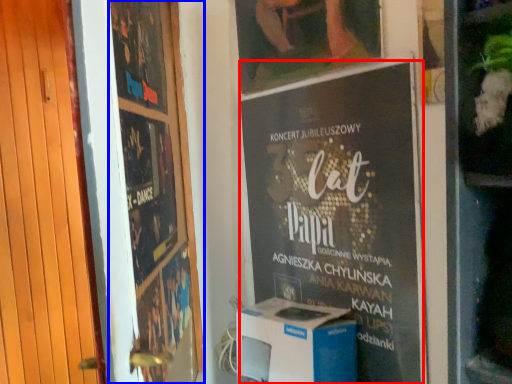
Question: Which object is further to the camera taking this photo, poster (highlighted by a red box) or poster (highlighted by a blue box)?

Choices:
 (A) poster
 (B) poster

Answer: (A)